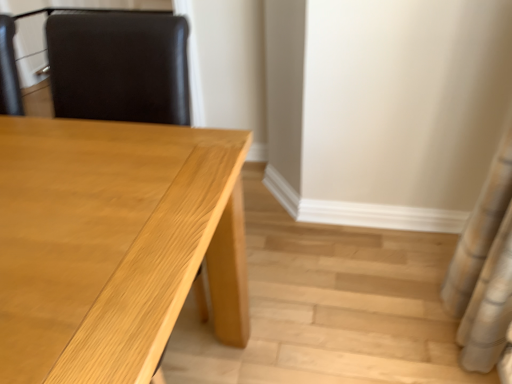
Question: From a real-world perspective, is light wood table at center under white textured shower curtain at right?

Choices:
 (A) yes
 (B) no

Answer: (A)

Question: Considering the relative sizes of light wood table at center and white textured shower curtain at right in the image provided, is light wood table at center thinner than white textured shower curtain at right?

Choices:
 (A) no
 (B) yes

Answer: (A)

Question: From the image's perspective, is light wood table at center below white textured shower curtain at right?

Choices:
 (A) yes
 (B) no

Answer: (A)

Question: Considering the relative sizes of light wood table at center and white textured shower curtain at right in the image provided, is light wood table at center taller than white textured shower curtain at right?

Choices:
 (A) no
 (B) yes

Answer: (A)

Question: Does light wood table at center have a smaller size compared to white textured shower curtain at right?

Choices:
 (A) yes
 (B) no

Answer: (B)

Question: Considering the relative positions of light wood table at center and white textured shower curtain at right in the image provided, is light wood table at center to the right of white textured shower curtain at right from the viewer's perspective?

Choices:
 (A) no
 (B) yes

Answer: (A)

Question: Is white textured shower curtain at right located outside light wood table at center?

Choices:
 (A) yes
 (B) no

Answer: (A)

Question: Does white textured shower curtain at right have a lesser width compared to light wood table at center?

Choices:
 (A) yes
 (B) no

Answer: (A)

Question: Considering the relative positions of white textured shower curtain at right and light wood table at center in the image provided, is white textured shower curtain at right to the right of light wood table at center from the viewer's perspective?

Choices:
 (A) no
 (B) yes

Answer: (B)

Question: Is white textured shower curtain at right far away from light wood table at center?

Choices:
 (A) no
 (B) yes

Answer: (A)

Question: Does white textured shower curtain at right have a larger size compared to light wood table at center?

Choices:
 (A) no
 (B) yes

Answer: (A)

Question: Considering the relative positions of white textured shower curtain at right and light wood table at center in the image provided, is white textured shower curtain at right to the left of light wood table at center from the viewer's perspective?

Choices:
 (A) yes
 (B) no

Answer: (B)

Question: Considering the positions of white textured shower curtain at right and light wood table at center in the image, is white textured shower curtain at right wider or thinner than light wood table at center?

Choices:
 (A) thin
 (B) wide

Answer: (A)